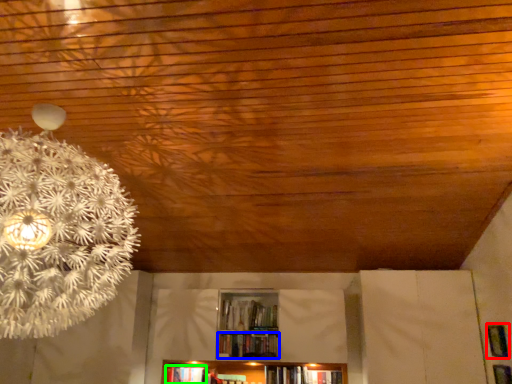
Question: Estimate the real-world distances between objects in this image. Which object is farther from panel (highlighted by a red box), book (highlighted by a blue box) or book (highlighted by a green box)?

Choices:
 (A) book
 (B) book

Answer: (B)